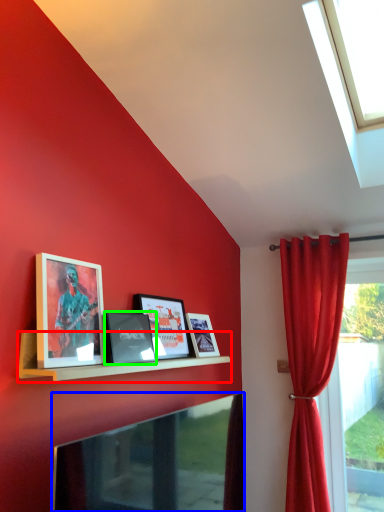
Question: Considering the real-world distances, which object is closest to shelf (highlighted by a red box)? television (highlighted by a blue box) or picture frame (highlighted by a green box).

Choices:
 (A) television
 (B) picture frame

Answer: (B)